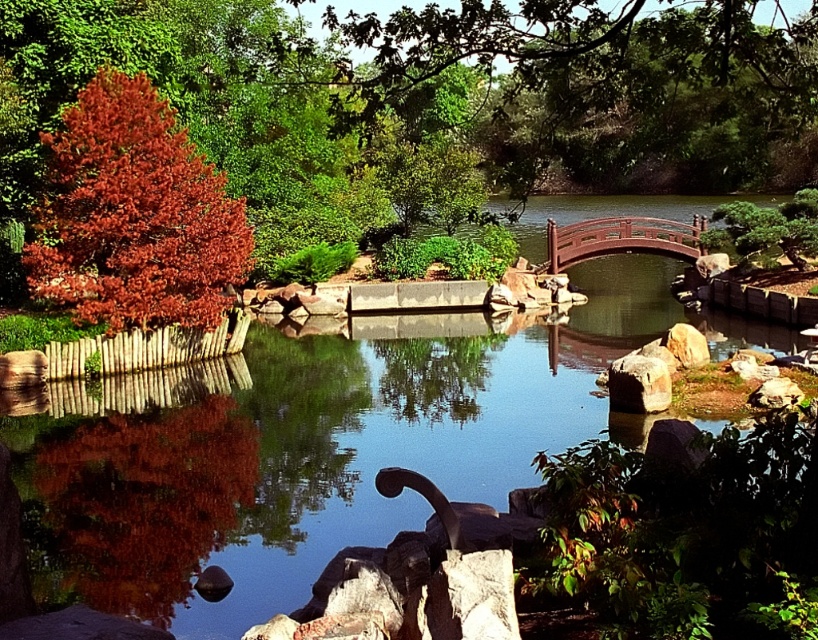
You are standing at the camera position in the garden scene. There is a point marked at coordinates point (135,285). Can you reach that point without moving closer than 19 meters from your current position?

The point (135,285) is 19.00 meters away from the camera, so yes, you can reach it without moving closer than 19 meters from your current position because it is exactly at that distance.

You are standing at the center of the garden and want to locate the shiny red tree at left. According to the coordinates provided, in which direction should you look to find it?

The shiny red tree at left is located at coordinates point (133, 216). Since you are at the center, you should look towards the left side of the garden to find it.

You are a gardener planning to install a new pathway between the shiny red tree at left and the wooden bridge at center. The pathway requires a minimum of 15 meters of space. Can the existing space accommodate this pathway?

The distance between the shiny red tree at left and the wooden bridge at center is 17.11 meters, which exceeds the required 15 meters. Therefore, the existing space can accommodate the pathway.